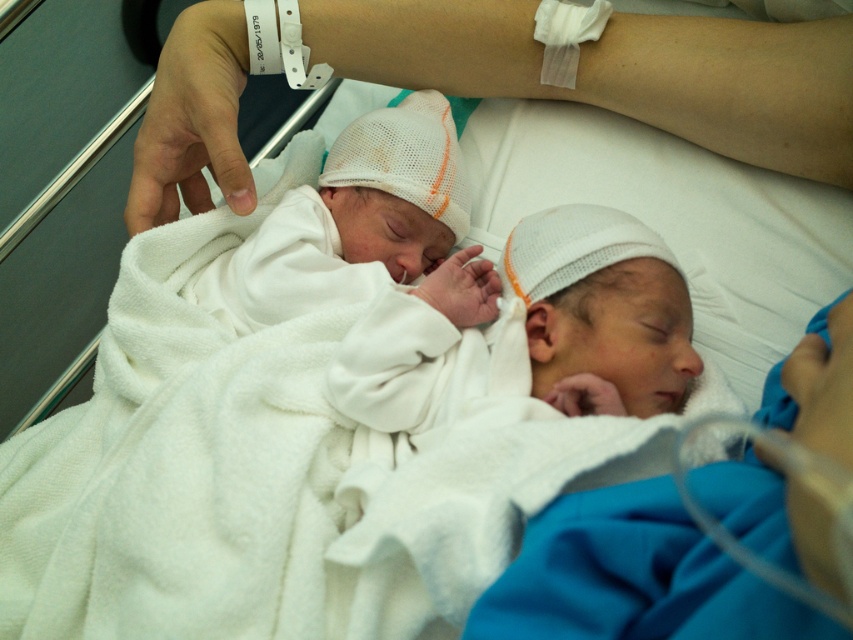
In the scene shown: You are a nurse in a neonatal unit and need to check the nasal cannula of the baby wearing the white knit cap at center and the white mesh hat at center. Which baby is closer to the left side so you can reach them first?

The white mesh hat at center is closer to the left side than the white knit cap at center, so you can reach the baby with the white mesh hat at center first.

You are a nurse in a neonatal unit and need to place a small medical device on the white knit cap at center. However, there is a white soft blanket at center nearby. Which object should you place the device on, and why?

You should place the device on the white knit cap at center because it is to the left of the white soft blanket at center, making it the appropriate location for the device based on the baby care protocol.

You are a nurse in a neonatal unit who needs to place a small medical device between the white knit cap at center and the white soft blanket at center. Can you fit it there?

The white knit cap at center and white soft blanket at center are 6.51 inches apart from each other. Since the space between them is 6.51 inches, the nurse can fit the small medical device there as it likely requires less space than that.